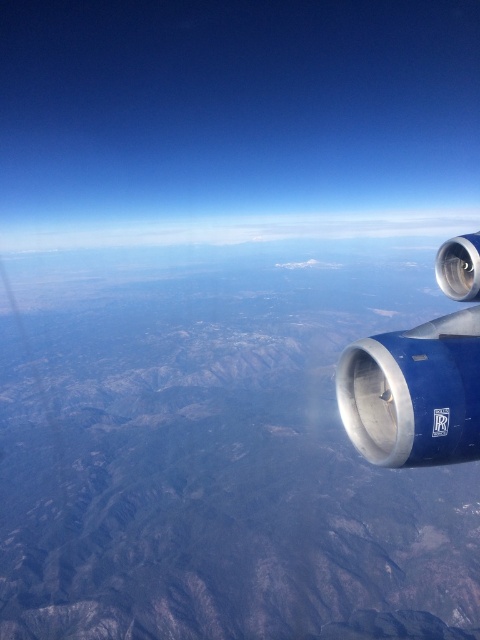
In the scene shown: You are a pilot looking out of the airplane window. You see the blue metallic engine at right and the white fluffy cloud at upper center. Which object is closer to you?

The blue metallic engine at right is closer to you because it is in front of the white fluffy cloud at upper center.

You are a pilot observing the view from the airplane window. You notice the blue metallic engine at right and the white fluffy cloud at upper center. Which object appears smaller in the scene?

The blue metallic engine at right appears smaller compared to the white fluffy cloud at upper center.